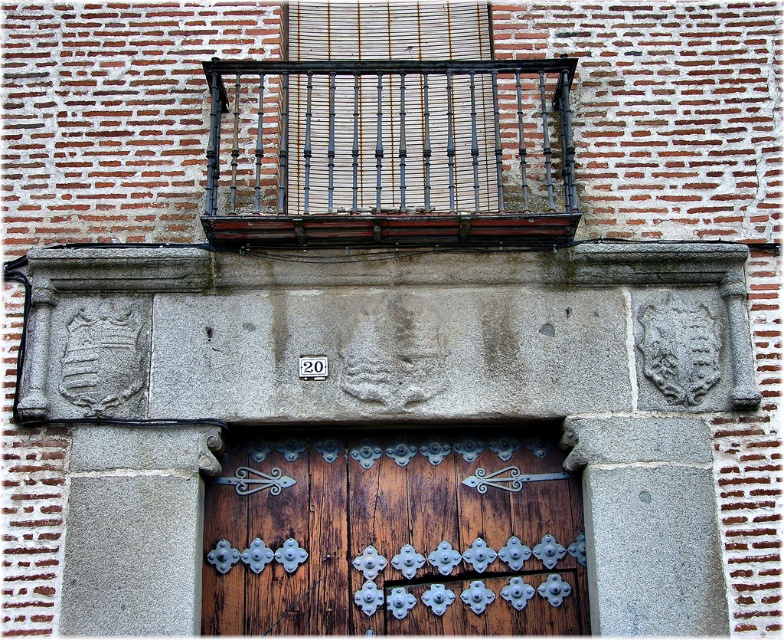
You are an architect inspecting the building facade. You notice the rusty metal balcony at upper center and the wooden slats at center. Which of these two elements has a greater surface area?

The rusty metal balcony at upper center has a greater surface area than the wooden slats at center because it is larger in size.

You are a delivery person trying to deliver a package to the building. The package requires a signature, so you need to locate the entrance. Based on the image, which object would you approach first, the wooden door with metal hinges at center or the wooden slats at center?

The wooden door with metal hinges at center is much taller than the wooden slats at center, so you should approach the wooden door with metal hinges at center as it is likely the entrance.

You are standing 20 meters away from a building facade. You see a point marked at coordinates point [532,241]. Is this point closer to you or farther than your current distance?

The point [532,241] is 17.38 meters away from the viewer, which is closer than the 20 meters distance you are currently at.